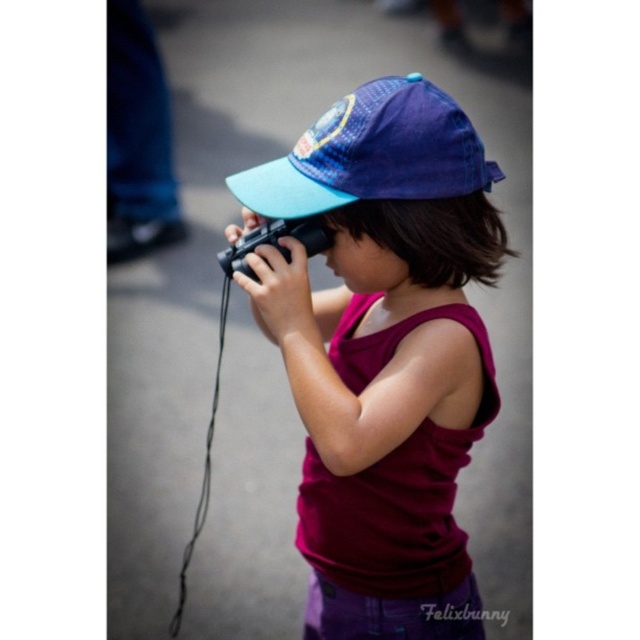
In the scene shown: The child is holding the black plastic camera at center and wearing the blue fabric baseball cap at center. Which object is wider?

The blue fabric baseball cap at center is wider than the black plastic camera at center.